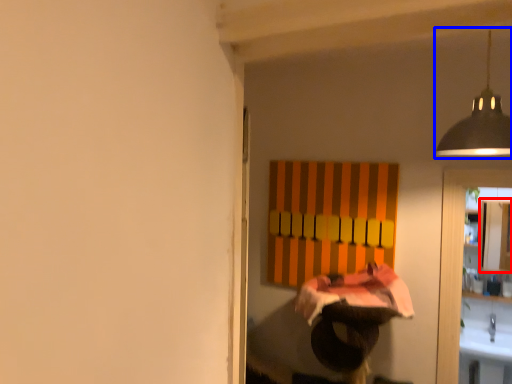
Question: Which point is closer to the camera, cabinetry (highlighted by a red box) or lamp (highlighted by a blue box)?

Choices:
 (A) cabinetry
 (B) lamp

Answer: (B)